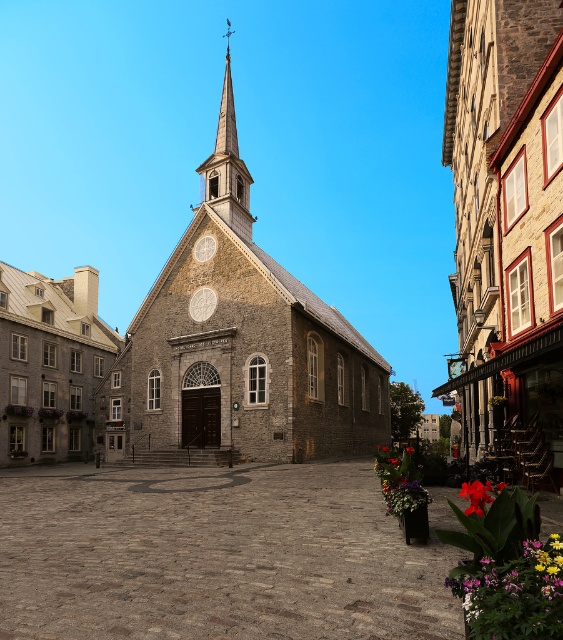
Question: Which object is the closest to the vibrant floral bouquet at lower right?

Choices:
 (A) wooden spire at center
 (B) vivid red petals at center
 (C) stone church at center

Answer: (B)

Question: Does brown stone church at center have a lesser width compared to vibrant floral bouquet at lower right?

Choices:
 (A) yes
 (B) no

Answer: (B)

Question: Which point is farther to the camera?

Choices:
 (A) (484, 72)
 (B) (406, 484)

Answer: (A)

Question: Which of the following is the farthest from the observer?

Choices:
 (A) click(x=173, y=346)
 (B) click(x=466, y=460)

Answer: (A)

Question: Is stone church at center above vivid red petals at lower right?

Choices:
 (A) no
 (B) yes

Answer: (B)

Question: Is brown stone church at center in front of vivid red petals at center?

Choices:
 (A) no
 (B) yes

Answer: (A)